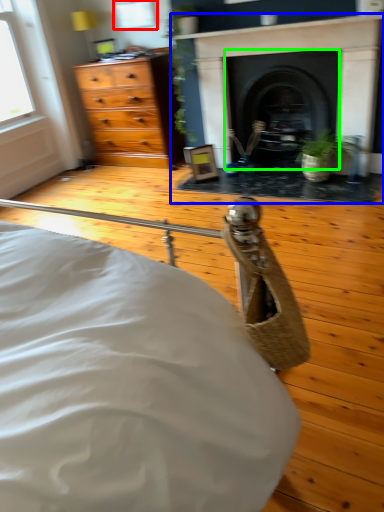
Question: Based on their relative distances, which object is nearer to window (highlighted by a red box)? Choose from fireplace (highlighted by a blue box) and fireplace (highlighted by a green box).

Choices:
 (A) fireplace
 (B) fireplace

Answer: (A)